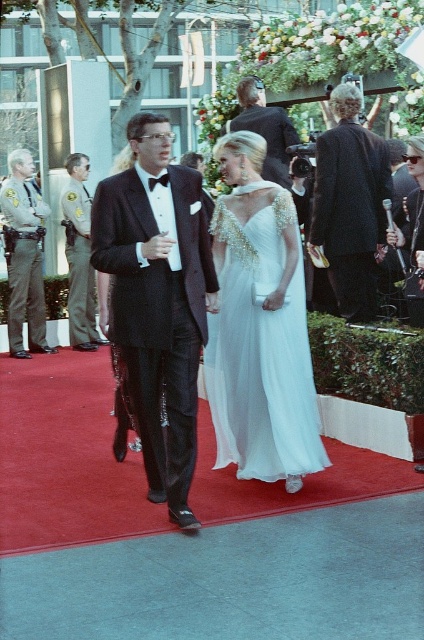
Question: Among these points, which one is farthest from the camera?

Choices:
 (A) [x=278, y=449]
 (B) [x=131, y=124]
 (C) [x=13, y=284]
 (D) [x=334, y=250]

Answer: (C)

Question: Which object is the closest to the white chiffon dress at center?

Choices:
 (A) dark wool suit at center
 (B) dark gray uniform at left
 (C) shiny black suit at center

Answer: (A)

Question: Is dark wool suit at center above shiny black suit at center?

Choices:
 (A) no
 (B) yes

Answer: (A)

Question: Where is shiny black tuxedo at center located in relation to shiny black suit at center in the image?

Choices:
 (A) right
 (B) left

Answer: (B)

Question: Which of the following is the farthest from the observer?

Choices:
 (A) dark gray uniform at left
 (B) shiny black tuxedo at center
 (C) shiny black suit at center
 (D) dark wool suit at center

Answer: (A)

Question: Does dark gray uniform at left have a lesser width compared to shiny black suit at center?

Choices:
 (A) no
 (B) yes

Answer: (B)